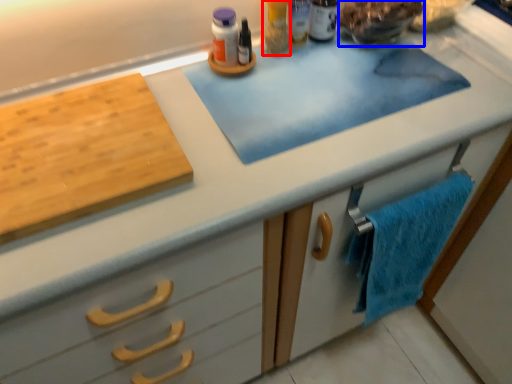
Question: Which object is further to the camera taking this photo, toiletry (highlighted by a red box) or food (highlighted by a blue box)?

Choices:
 (A) toiletry
 (B) food

Answer: (A)